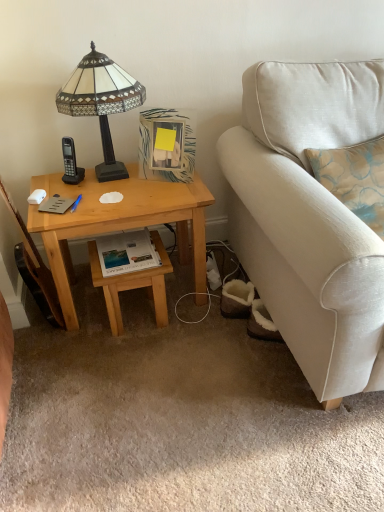
Question: From the image's perspective, is white glossy book at center above or below light wood desk at left?

Choices:
 (A) below
 (B) above

Answer: (A)

Question: From a real-world perspective, is white glossy book at center physically located above or below light wood desk at left?

Choices:
 (A) below
 (B) above

Answer: (B)

Question: Based on their relative distances, which object is farther from the light wood desk at left?

Choices:
 (A) stained glass lampshade at upper left
 (B) beige fabric couch at right
 (C) white glossy book at center
 (D) light wood stool at lower center

Answer: (B)

Question: Estimate the real-world distances between objects in this image. Which object is closer to the light wood desk at left?

Choices:
 (A) white glossy book at center
 (B) light wood stool at lower center
 (C) beige fabric couch at right
 (D) stained glass lampshade at upper left

Answer: (B)